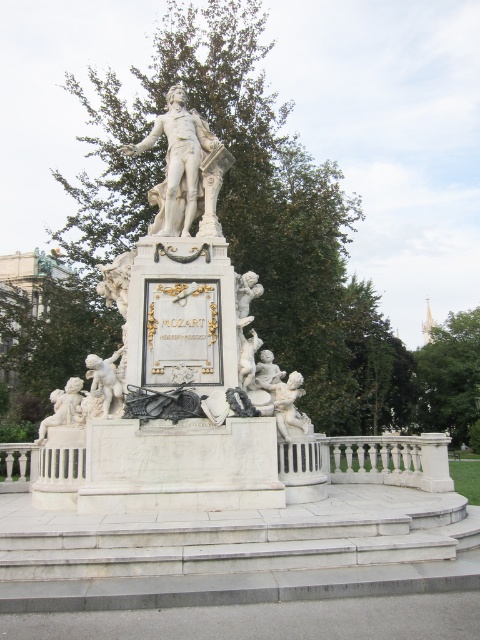
Question: Is white marble railing at center above white marble cherub at lower left?

Choices:
 (A) no
 (B) yes

Answer: (A)

Question: Which point is farther to the camera?

Choices:
 (A) (113, 371)
 (B) (14, 456)
 (C) (180, 157)
 (D) (79, 381)

Answer: (B)

Question: Among these objects, which one is farthest from the camera?

Choices:
 (A) matte white cherub at lower left
 (B) white marble cherub at lower left
 (C) white marble statue at center

Answer: (C)

Question: Can you confirm if white marble statue at center is positioned to the right of white marble cherub at lower left?

Choices:
 (A) no
 (B) yes

Answer: (B)

Question: Among these objects, which one is nearest to the camera?

Choices:
 (A) white marble cherub at lower left
 (B) matte white cherub at lower left
 (C) white marble railing at center

Answer: (B)

Question: Does white marble railing at center appear under matte white cherub at lower left?

Choices:
 (A) yes
 (B) no

Answer: (A)